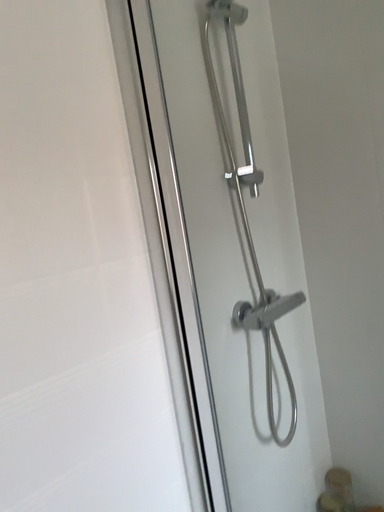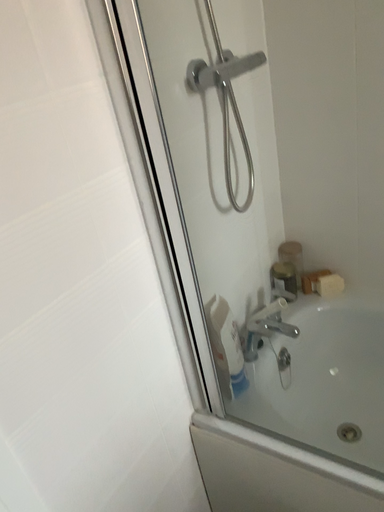
Question: How did the camera likely rotate when shooting the video?

Choices:
 (A) rotated left
 (B) rotated right

Answer: (B)